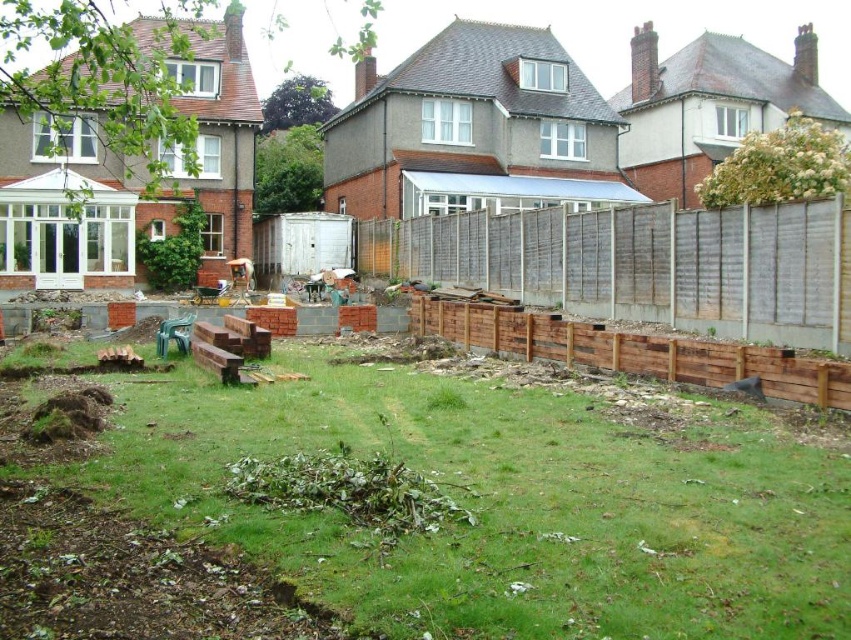
Is green grass at center shorter than brown wooden fence at center?

Yes.

Between green grass at center and brown wooden fence at center, which one is positioned higher?

brown wooden fence at center is above.

This screenshot has width=851, height=640. What do you see at coordinates (507, 499) in the screenshot? I see `green grass at center` at bounding box center [507, 499].

The width and height of the screenshot is (851, 640). What are the coordinates of `green grass at center` in the screenshot? It's located at (507, 499).